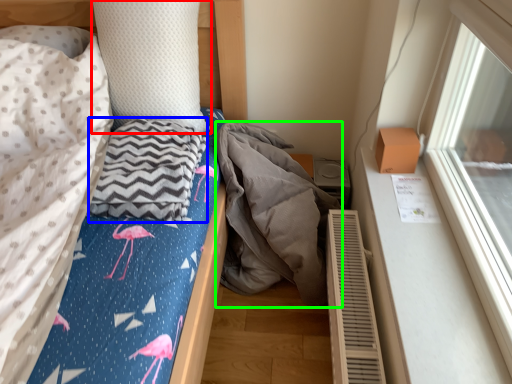
Question: Considering the real-world distances, which object is closest to pillow (highlighted by a red box)? material (highlighted by a blue box) or material (highlighted by a green box).

Choices:
 (A) material
 (B) material

Answer: (A)